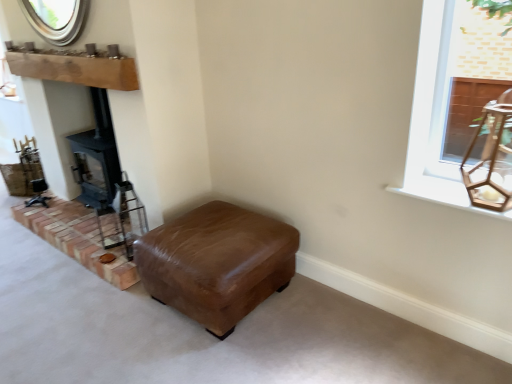
Question: Considering the positions of brown brickwork at lower left and white wood window sill at upper right in the image, is brown brickwork at lower left wider or thinner than white wood window sill at upper right?

Choices:
 (A) thin
 (B) wide

Answer: (B)

Question: From the image's perspective, relative to white wood window sill at upper right, is brown brickwork at lower left above or below?

Choices:
 (A) above
 (B) below

Answer: (B)

Question: Which of these objects is positioned farthest from the natural wood mantle at upper left?

Choices:
 (A) brown brickwork at lower left
 (B) brown leather ottoman at center
 (C) white wood window sill at upper right

Answer: (C)

Question: Which of these objects is positioned farthest from the brown leather ottoman at center?

Choices:
 (A) brown brickwork at lower left
 (B) white wood window sill at upper right
 (C) natural wood mantle at upper left

Answer: (C)